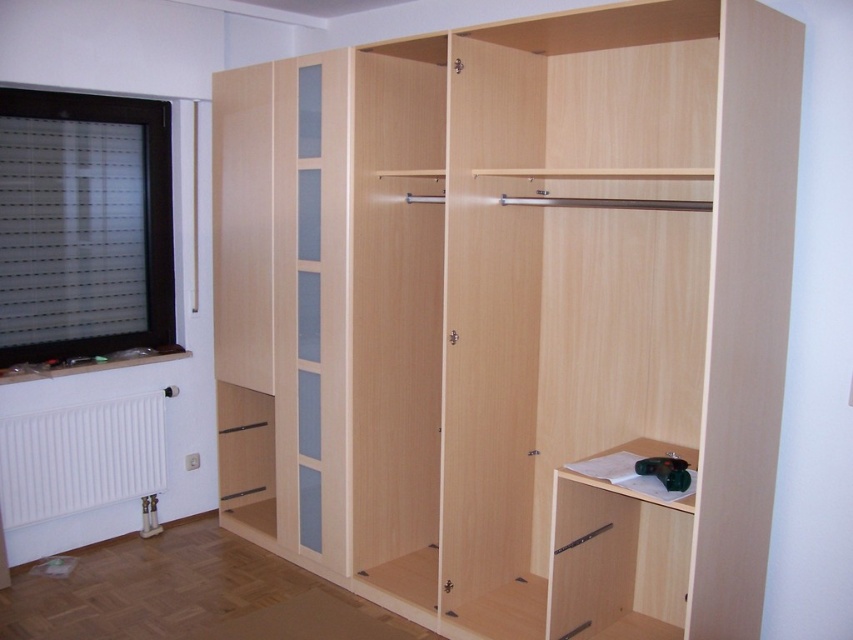
Please provide the coordinates of the light wood closet at center in the image. The coordinates should be in the format of a point with two decimal places, such as 0.5,0.5.

The coordinates of the light wood closet at center are (525, 300).

You are trying to decide where to place a tall bookshelf in the room. The bookshelf is taller than the white matte radiator at lower left but shorter than the light wood closet at center. Based on the scene, where could you place the bookshelf so it doesn

The light wood closet at center has a greater height compared to the white matte radiator at lower left. Since the bookshelf is taller than the radiator but shorter than the closet, it can be placed near the radiator or other areas where height isn

You are a contractor working in the room and need to access the white matte radiator at lower left for maintenance. Is the light wood closet at center blocking your access to it?

The light wood closet at center is positioned over the white matte radiator at lower left, so it is blocking access to the radiator. You will need to move the closet to reach the radiator.